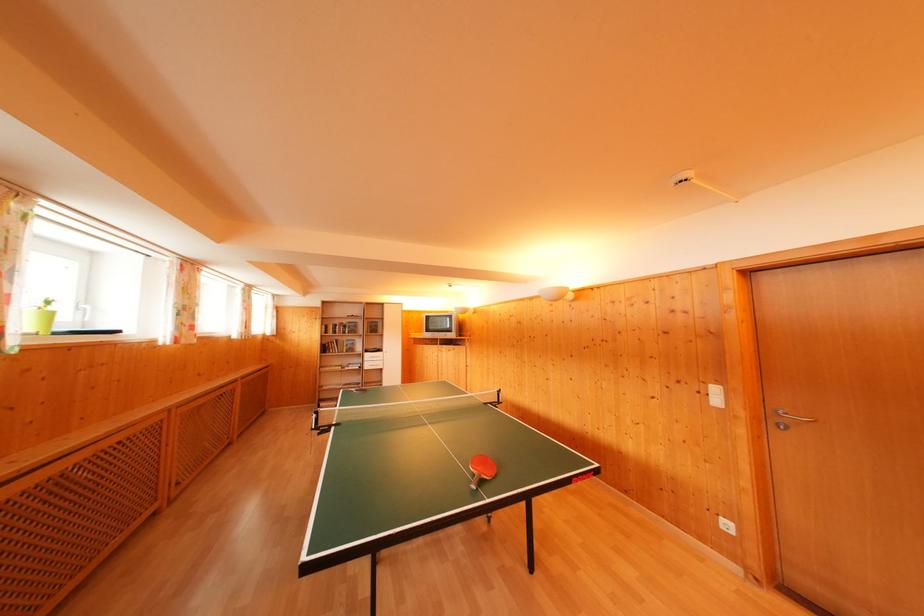
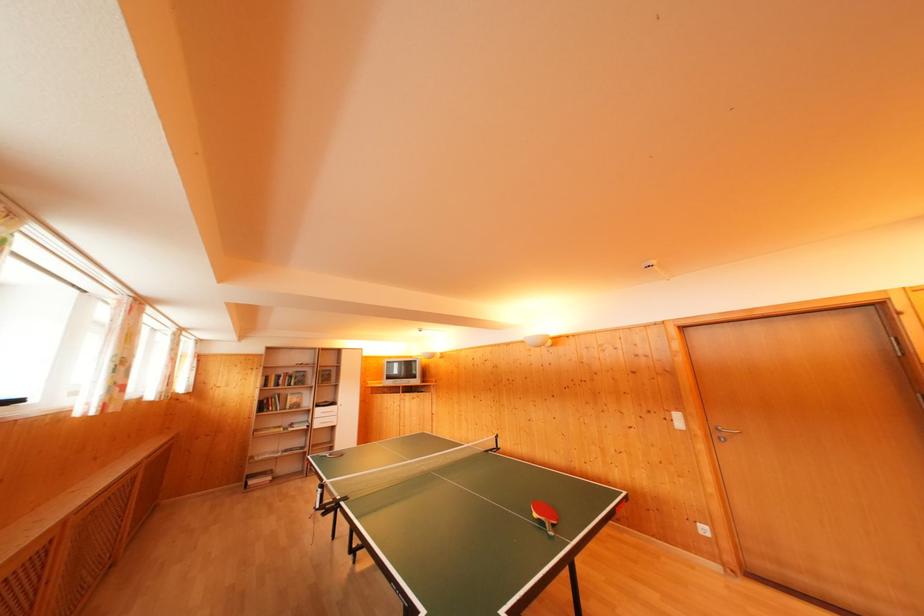
In the second image, find the point that corresponds to the point at 330,354 in the first image.

(268, 411)